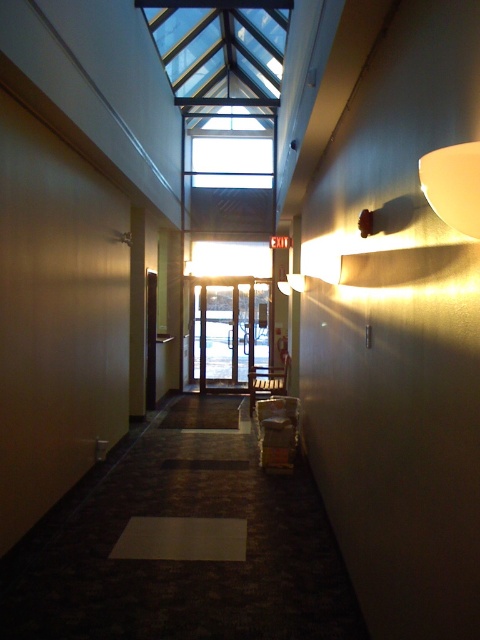
Question: Does transparent glass elevator at center appear on the left side of matte white sconce at upper right?

Choices:
 (A) yes
 (B) no

Answer: (A)

Question: Among these objects, which one is nearest to the camera?

Choices:
 (A) matte white sconce at upper right
 (B) transparent glass elevator at center

Answer: (A)

Question: Is transparent glass elevator at center closer to camera compared to matte white sconce at upper right?

Choices:
 (A) no
 (B) yes

Answer: (A)

Question: Is transparent glass elevator at center above matte white sconce at upper right?

Choices:
 (A) yes
 (B) no

Answer: (B)

Question: Among these objects, which one is farthest from the camera?

Choices:
 (A) matte white sconce at upper right
 (B) transparent glass elevator at center

Answer: (B)